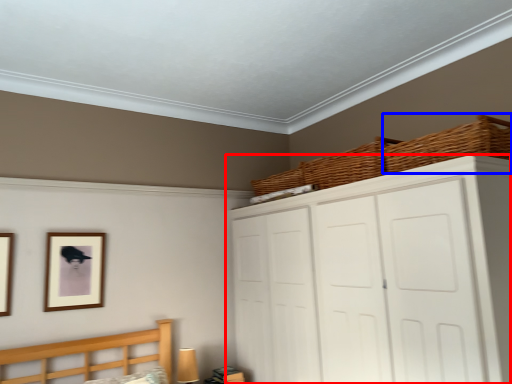
Question: Among these objects, which one is nearest to the camera, cupboard (highlighted by a red box) or basket (highlighted by a blue box)?

Choices:
 (A) cupboard
 (B) basket

Answer: (A)